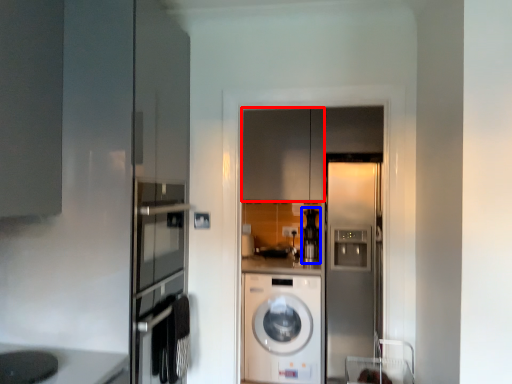
Question: Which point is further to the camera, cabinetry (highlighted by a red box) or coffee machine (highlighted by a blue box)?

Choices:
 (A) cabinetry
 (B) coffee machine

Answer: (B)